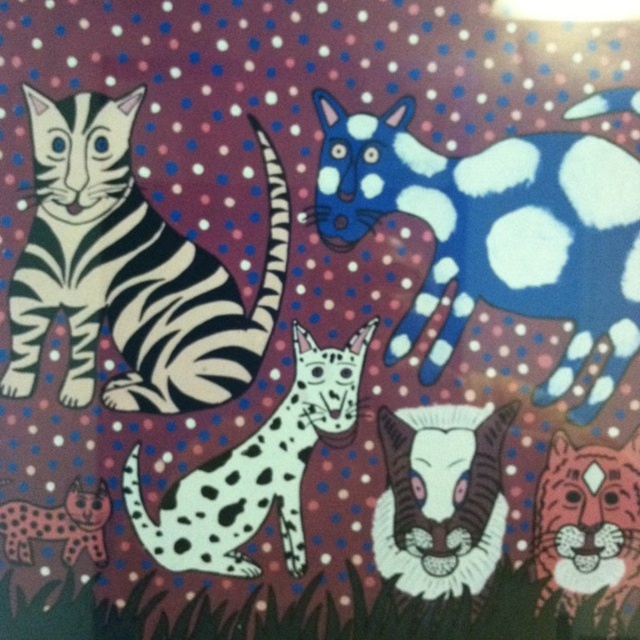
You are a cat enthusiast observing the image. You want to know if the distance between the blue spotted cat at upper right and the spotted fur cat at lower left is more than 20 inches. Can you confirm?

The blue spotted cat at upper right and spotted fur cat at lower left are 20.93 inches apart from each other, so yes, the distance between them is more than 20 inches.

You are a cat owner who wants to buy a collar for both the blue spotted cat at upper right and the spotted fur cat at lower left. The store has collars in two sizes, small and large. The small collars can fit cats up to 30 cm in width, while large collars can accommodate up to 50 cm. According to the image, which collar size should each cat get?

The blue spotted cat at upper right has a larger width than the spotted fur cat at lower left. Since the large collar fits up to 50 cm, the blue spotted cat at upper right should get a large collar. The spotted fur cat at lower left should get a small collar as it is smaller than the blue spotted cat at upper right.

Where is the blue spotted cat at upper right located in the image?

The blue spotted cat at upper right is located at point (497, 234).